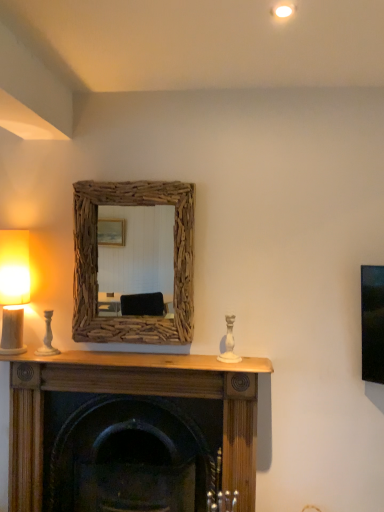
In order to face driftwood mirror at center, should I rotate leftwards or rightwards?

Rotate left and turn 7.943 degrees.

The image size is (384, 512). What do you see at coordinates (14, 288) in the screenshot? I see `matte white table lamp at left` at bounding box center [14, 288].

Locate an element on the screen. driftwood mirror at center is located at coordinates (97, 263).

Does point (129, 385) lie in front of point (92, 298)?

No, it is not.

Choose the correct answer: Is wooden fireplace at center inside driftwood mirror at center or outside it?

wooden fireplace at center lies outside driftwood mirror at center.

Looking at this image, measure the distance between wooden fireplace at center and driftwood mirror at center.

wooden fireplace at center and driftwood mirror at center are 17.90 inches apart.

Is wooden fireplace at center taller than driftwood mirror at center?

Yes, wooden fireplace at center is taller than driftwood mirror at center.

Locate an element on the screen. The image size is (384, 512). picture frame located behind the wooden fireplace at center is located at coordinates (97, 263).

How far apart are driftwood mirror at center and wooden fireplace at center?

A distance of 45.47 centimeters exists between driftwood mirror at center and wooden fireplace at center.

Can you confirm if driftwood mirror at center is positioned to the right of wooden fireplace at center?

No, driftwood mirror at center is not to the right of wooden fireplace at center.

From the image's perspective, who appears lower, driftwood mirror at center or wooden fireplace at center?

wooden fireplace at center appears lower in the image.

Based on their sizes in the image, would you say wooden fireplace at center is bigger or smaller than matte white table lamp at left?

Clearly, wooden fireplace at center is larger in size than matte white table lamp at left.

What's the angular difference between wooden fireplace at center and matte white table lamp at left's facing directions?

The facing directions of wooden fireplace at center and matte white table lamp at left are 0.0137 degrees apart.

Is wooden fireplace at center not inside matte white table lamp at left?

Yes.

Which object is thinner, wooden fireplace at center or matte white table lamp at left?

Thinner between the two is matte white table lamp at left.

Is matte white table lamp at left inside the boundaries of driftwood mirror at center, or outside?

matte white table lamp at left is not inside driftwood mirror at center, it's outside.

Where is `picture frame that is behind the matte white table lamp at left`? Image resolution: width=384 pixels, height=512 pixels. picture frame that is behind the matte white table lamp at left is located at coordinates (97, 263).

From a real-world perspective, which object stands above the other?

driftwood mirror at center.

Is matte white table lamp at left shorter than driftwood mirror at center?

Correct, matte white table lamp at left is not as tall as driftwood mirror at center.

Is matte white table lamp at left placed right next to wooden fireplace at center?

They are not placed beside each other.

You are a GUI agent. You are given a task and a screenshot of the screen. Output one action in this format:
    pyautogui.click(x=<x>, y=<y>)
    Task: Click on the table lamp behind the wooden fireplace at center
    The height and width of the screenshot is (512, 384).
    Given the screenshot: What is the action you would take?
    pyautogui.click(x=14, y=288)

From the image's perspective, which is above, matte white table lamp at left or wooden fireplace at center?

matte white table lamp at left, from the image's perspective.

Between matte white table lamp at left and wooden fireplace at center, which one appears on the left side from the viewer's perspective?

From the viewer's perspective, matte white table lamp at left appears more on the left side.

Measure the distance between driftwood mirror at center and matte white table lamp at left.

Result: driftwood mirror at center is 41.66 centimeters away from matte white table lamp at left.

Would you say driftwood mirror at center is a long distance from matte white table lamp at left?

Result: They are positioned close to each other.

Which is more to the left, driftwood mirror at center or matte white table lamp at left?

Positioned to the left is matte white table lamp at left.

Do you think driftwood mirror at center is within matte white table lamp at left, or outside of it?

driftwood mirror at center cannot be found inside matte white table lamp at left.

The image size is (384, 512). Find the location of `fireplace below the driftwood mirror at center (from a real-world perspective)`. fireplace below the driftwood mirror at center (from a real-world perspective) is located at coordinates (132, 393).

Where is `fireplace in front of the driftwood mirror at center`? This screenshot has width=384, height=512. fireplace in front of the driftwood mirror at center is located at coordinates (132, 393).

Based on their spatial positions, is driftwood mirror at center or matte white table lamp at left closer to wooden fireplace at center?

driftwood mirror at center.

From the image, which object appears to be farther from matte white table lamp at left, wooden fireplace at center or driftwood mirror at center?

The object further to matte white table lamp at left is wooden fireplace at center.

When comparing their distances from driftwood mirror at center, does wooden fireplace at center or matte white table lamp at left seem closer?

matte white table lamp at left is closer to driftwood mirror at center.

Considering their positions, is matte white table lamp at left positioned further to wooden fireplace at center than driftwood mirror at center?

Among the two, matte white table lamp at left is located further to wooden fireplace at center.

Based on their spatial positions, is driftwood mirror at center or wooden fireplace at center closer to matte white table lamp at left?

driftwood mirror at center is closer to matte white table lamp at left.

When comparing their distances from driftwood mirror at center, does matte white table lamp at left or wooden fireplace at center seem further?

Based on the image, wooden fireplace at center appears to be further to driftwood mirror at center.

You are a GUI agent. You are given a task and a screenshot of the screen. Output one action in this format:
    pyautogui.click(x=<x>, y=<y>)
    Task: Click on the table lamp between driftwood mirror at center and wooden fireplace at center in the up-down direction
    This screenshot has width=384, height=512.
    Given the screenshot: What is the action you would take?
    pyautogui.click(x=14, y=288)